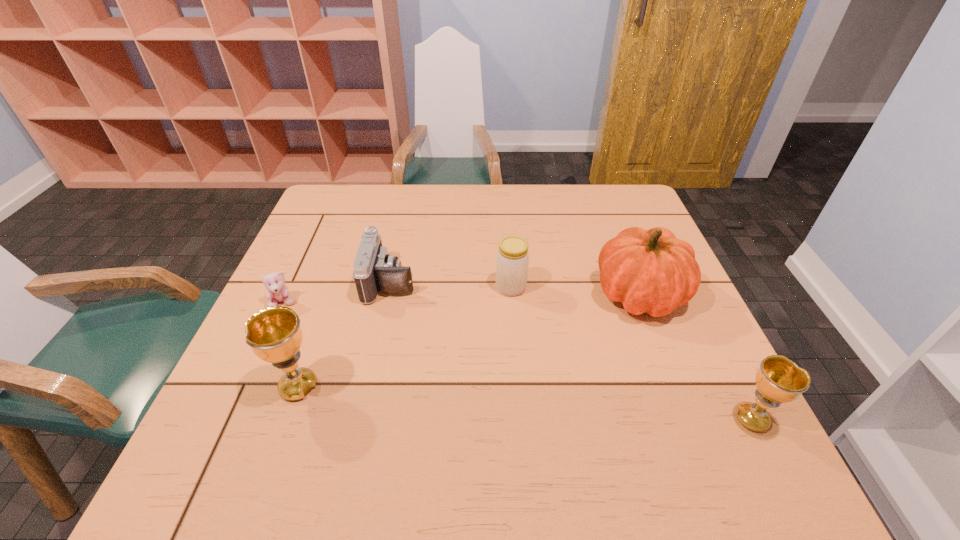
Locate an element on the screen. The height and width of the screenshot is (540, 960). vacant space that satisfies the following two spatial constraints: 1. at the front of the fourth object from left to right with an open lens cover; 2. on the left side of the camera is located at coordinates (389, 287).

Locate an element on the screen. The image size is (960, 540). vacant area that satisfies the following two spatial constraints: 1. at the front of the jar with an open lens cover; 2. on the right side of the camera is located at coordinates (389, 287).

Where is `free space that satisfies the following two spatial constraints: 1. at the front of the third object from left to right with an open lens cover; 2. at the face of the shortest object`? This screenshot has width=960, height=540. free space that satisfies the following two spatial constraints: 1. at the front of the third object from left to right with an open lens cover; 2. at the face of the shortest object is located at coordinates (385, 303).

You are a GUI agent. You are given a task and a screenshot of the screen. Output one action in this format:
    pyautogui.click(x=<x>, y=<y>)
    Task: Click on the free point that satisfies the following two spatial constraints: 1. on the back side of the pumpkin; 2. at the front of the fifth tallest object with an open lens cover
    The width and height of the screenshot is (960, 540).
    Given the screenshot: What is the action you would take?
    pyautogui.click(x=635, y=281)

Where is `free location that satisfies the following two spatial constraints: 1. at the front of the camera with an open lens cover; 2. on the back side of the right chalice`? The height and width of the screenshot is (540, 960). free location that satisfies the following two spatial constraints: 1. at the front of the camera with an open lens cover; 2. on the back side of the right chalice is located at coordinates (359, 419).

Locate an element on the screen. Image resolution: width=960 pixels, height=540 pixels. free point that satisfies the following two spatial constraints: 1. at the front of the third object from left to right with an open lens cover; 2. on the back side of the fourth object from left to right is located at coordinates (389, 287).